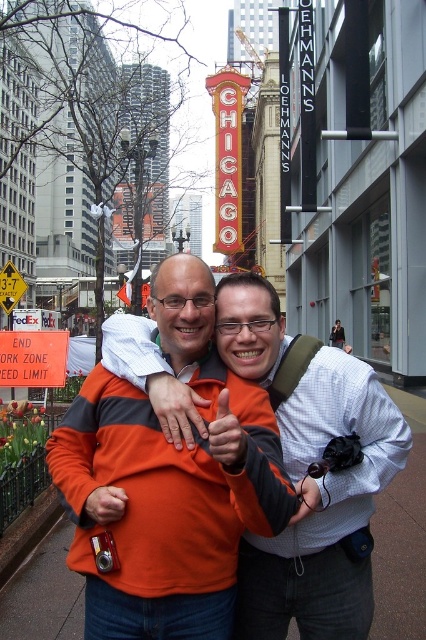
You are a photographer trying to frame a shot that includes both the CHICAGO sign in the background and the orange fleece jacket at center. Given the jacket is at coordinates point 0.730, 0.545, where should you position your camera to ensure both elements are in focus?

To ensure both the CHICAFICAGO sign in the background and the orange fleece jacket at center are in focus, position your camera so the jacket is at the point [232,467] and adjust the focal length to include the background sign. Since the jacket is centrally located, aligning the camera to this point will help maintain both elements within the depth of field.

You are a photographer trying to capture the orange plastic sign at lower left in your shot. Based on its position, where should you aim your camera relative to the lower edge of the frame?

The orange plastic sign at lower left is located at point 0.561 along the horizontal axis and 0.077 along the vertical axis from the lower left corner of the frame. To capture it, aim your camera slightly to the right of the lower edge, closer to the left side, approximately 56.1 percent from the left and 7.7 percent up from the bottom.